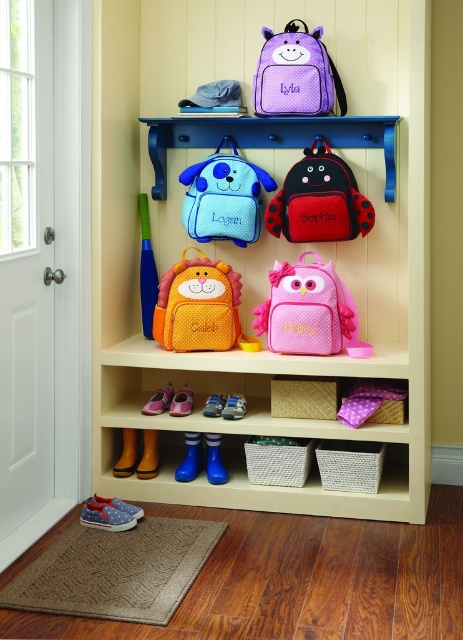
You are standing in the mudroom and want to place a new backpack between the two points marked as point (344, 324) and point (181, 328). Since you need to know which point is closer to you to position it correctly, can you tell me which point is nearer?

Point (344, 324) is closer to the camera than point (181, 328), so you should position the backpack closer to point (344, 324) to ensure it is near the front of the storage area.

You are helping a child find their backpack in the mudroom. The child says they have an orange dotted backpack at center and a matte blue backpack at upper center. Which backpack should they check first if their backpack is the bigger one?

The orange dotted backpack at center is larger in size than the matte blue backpack at upper center, so the child should check the orange dotted backpack at center first.